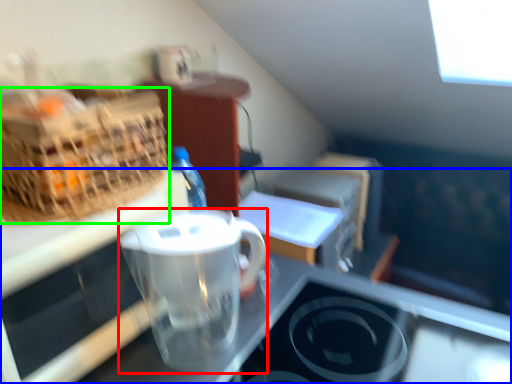
Question: Which object is the farthest from coffee cup (highlighted by a red box)? Choose among these: desk (highlighted by a blue box) or picnic basket (highlighted by a green box).

Choices:
 (A) desk
 (B) picnic basket

Answer: (B)